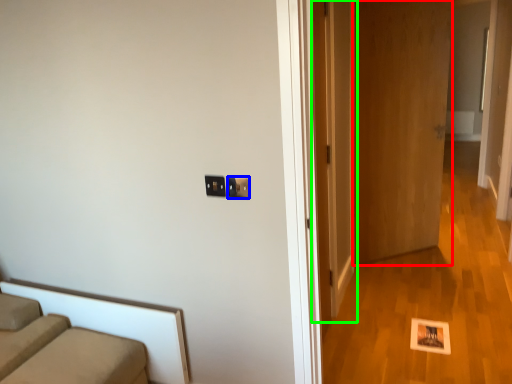
Question: Considering the real-world distances, which object is closest to door (highlighted by a red box)? electric outlet (highlighted by a blue box) or door (highlighted by a green box).

Choices:
 (A) electric outlet
 (B) door

Answer: (B)